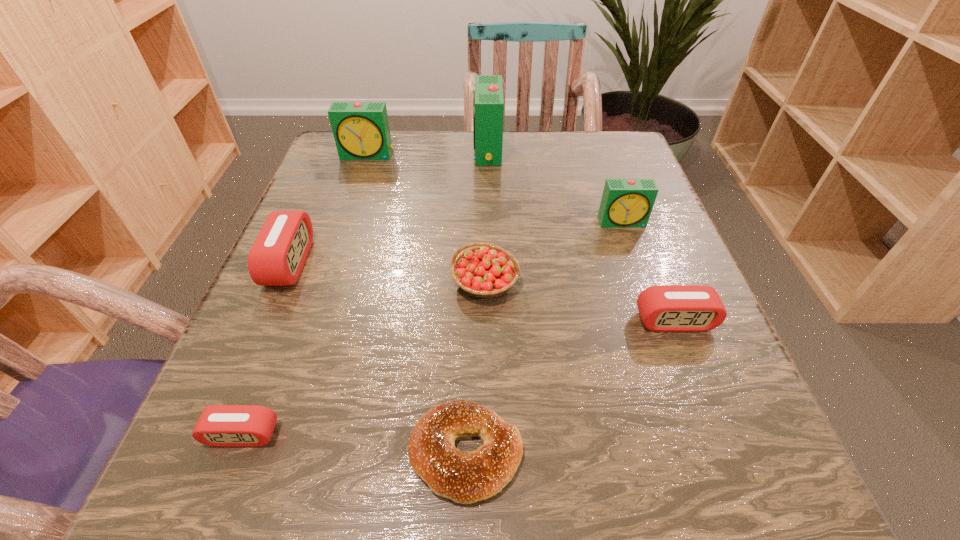
Locate an element on the screen. This screenshot has height=540, width=960. vacant space located 0.330m on the front-facing side of the third nearest alarm clock is located at coordinates (494, 262).

You are a GUI agent. You are given a task and a screenshot of the screen. Output one action in this format:
    pyautogui.click(x=<x>, y=<y>)
    Task: Click on the free location located 0.210m on the front-facing side of the second biggest pink alarm clock
    This screenshot has height=540, width=960.
    Given the screenshot: What is the action you would take?
    pyautogui.click(x=734, y=476)

Identify the location of vacant space positioned on the left of the bagel. (352, 453).

You are a GUI agent. You are given a task and a screenshot of the screen. Output one action in this format:
    pyautogui.click(x=<x>, y=<y>)
    Task: Click on the alarm clock located in the near edge section of the desktop
    Image resolution: width=960 pixels, height=540 pixels.
    Given the screenshot: What is the action you would take?
    pyautogui.click(x=220, y=425)

Where is `bagel that is positioned at the near edge`? Image resolution: width=960 pixels, height=540 pixels. bagel that is positioned at the near edge is located at coordinates (465, 477).

Where is `object situated at the far left corner`? This screenshot has width=960, height=540. object situated at the far left corner is located at coordinates (361, 131).

This screenshot has width=960, height=540. I want to click on object positioned at the near left corner, so click(220, 425).

In the image, there is a desktop. Identify the location of free space at the far edge. (429, 169).

Where is `free location at the near edge of the desktop`? The width and height of the screenshot is (960, 540). free location at the near edge of the desktop is located at coordinates (613, 483).

The image size is (960, 540). I want to click on vacant space at the left edge, so click(x=328, y=230).